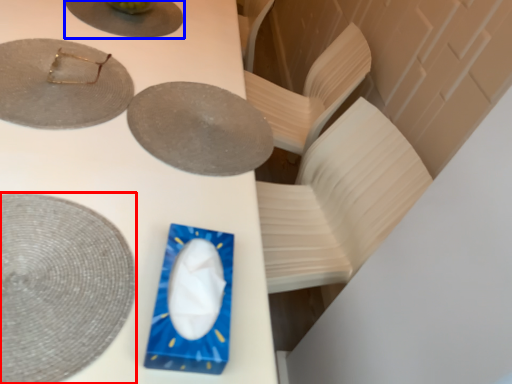
Question: Which point is closer to the camera, plate (highlighted by a red box) or plate (highlighted by a blue box)?

Choices:
 (A) plate
 (B) plate

Answer: (A)